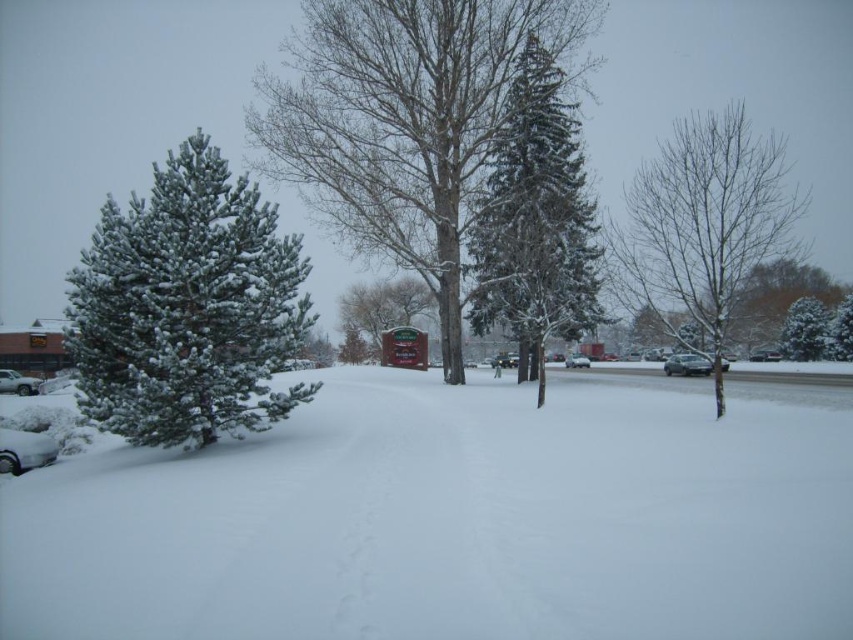
This screenshot has width=853, height=640. What do you see at coordinates (451, 520) in the screenshot?
I see `white fluffy snow at center` at bounding box center [451, 520].

Is white fluffy snow at center to the right of sleek silver sedan at center from the viewer's perspective?

Incorrect, white fluffy snow at center is not on the right side of sleek silver sedan at center.

Is point (465, 435) closer to camera compared to point (584, 362)?

Yes, point (465, 435) is in front of point (584, 362).

The width and height of the screenshot is (853, 640). I want to click on white fluffy snow at center, so click(x=451, y=520).

Which is more to the right, snow-covered evergreen tree at center or green matte tree at center?

green matte tree at center is more to the right.

Can you confirm if snow-covered evergreen tree at center is positioned to the right of green matte tree at center?

Incorrect, snow-covered evergreen tree at center is not on the right side of green matte tree at center.

Who is more forward, [524,6] or [825,348]?

Positioned in front is point [524,6].

Locate an element on the screen. snow-covered evergreen tree at center is located at coordinates (405, 122).

Does snow-covered evergreen at center lie behind white matte car at lower left?

No, it is not.

Between snow-covered evergreen at center and white matte car at lower left, which one is positioned higher?

snow-covered evergreen at center is above.

Where is `snow-covered evergreen at center`? The image size is (853, 640). snow-covered evergreen at center is located at coordinates (535, 221).